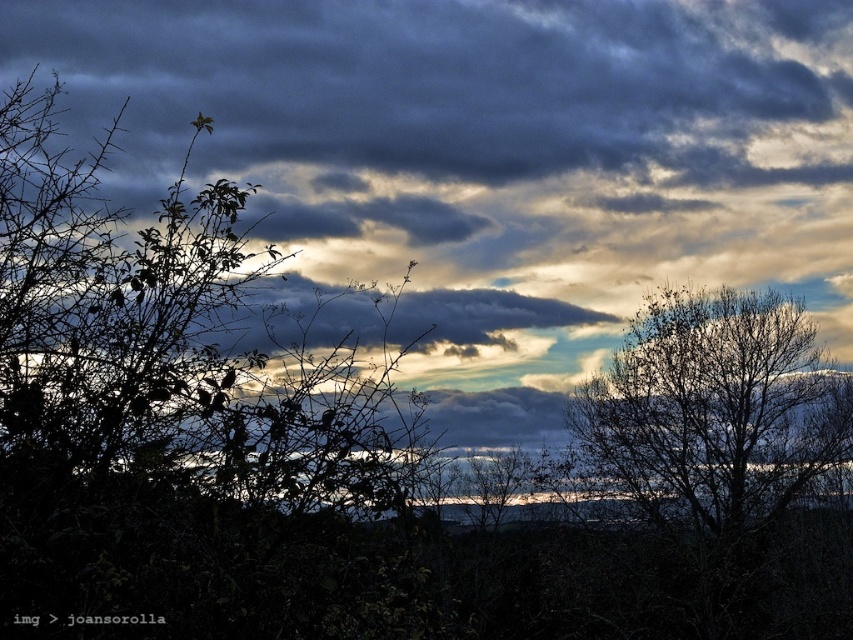
Between cloudy sky at upper center and bare branches at upper right, which one appears on the right side from the viewer's perspective?

bare branches at upper right

Can you confirm if cloudy sky at upper center is positioned to the left of bare branches at upper right?

Yes, cloudy sky at upper center is to the left of bare branches at upper right.

Is point (361, 250) more distant than point (653, 454)?

No, it is in front of (653, 454).

Locate an element on the screen. This screenshot has width=853, height=640. cloudy sky at upper center is located at coordinates (490, 157).

Between point (268, 490) and point (839, 442), which one is positioned behind?

Point (839, 442)

Can you confirm if green matte tree at left is shorter than bare branches at upper right?

No.

Which is in front, point (370, 486) or point (785, 483)?

Point (370, 486) is in front.

You are a GUI agent. You are given a task and a screenshot of the screen. Output one action in this format:
    pyautogui.click(x=<x>, y=<y>)
    Task: Click on the green matte tree at left
    
    Given the screenshot: What is the action you would take?
    pyautogui.click(x=171, y=342)

Can you confirm if cloudy sky at upper center is bigger than green matte tree at left?

Yes.

Is cloudy sky at upper center wider than green matte tree at left?

Indeed, cloudy sky at upper center has a greater width compared to green matte tree at left.

This screenshot has height=640, width=853. In order to click on cloudy sky at upper center in this screenshot , I will do `click(490, 157)`.